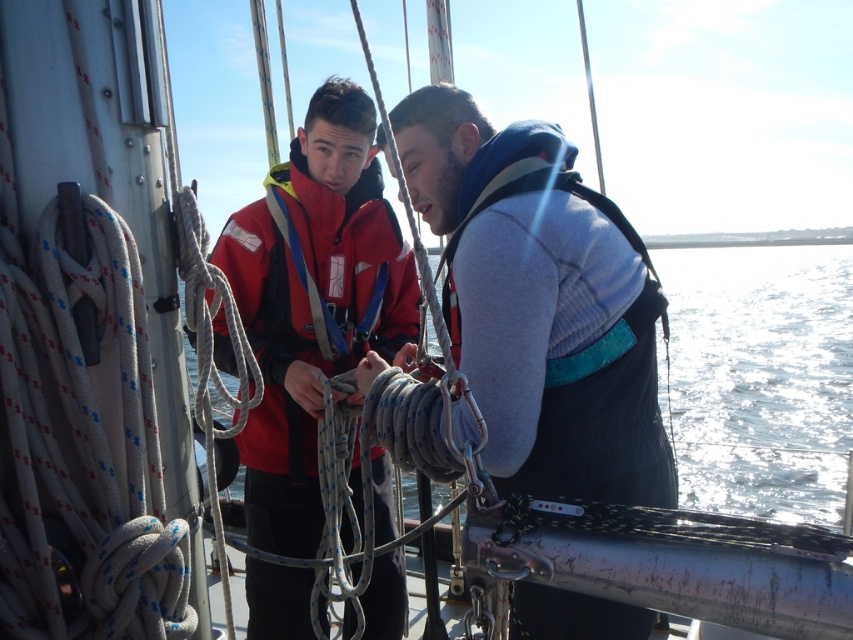
Question: Observing the image, what is the correct spatial positioning of gray fleece sweater at center in reference to matte red life jacket at center?

Choices:
 (A) below
 (B) above

Answer: (A)

Question: Is gray fleece sweater at center positioned behind matte red life jacket at center?

Choices:
 (A) yes
 (B) no

Answer: (B)

Question: Is gray fleece sweater at center wider than matte red life jacket at center?

Choices:
 (A) yes
 (B) no

Answer: (A)